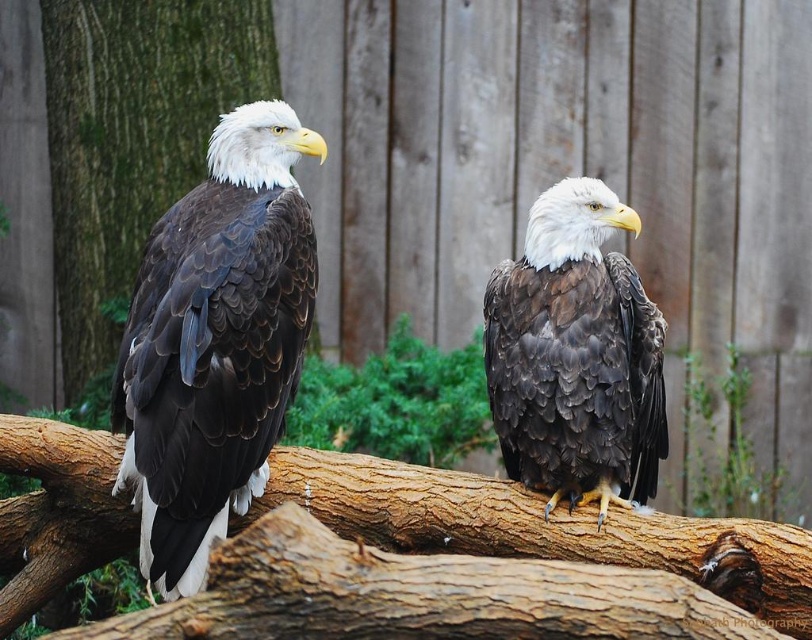
Between dark brown feathers at left and brown rough wood at center, which one appears on the left side from the viewer's perspective?

Positioned to the left is dark brown feathers at left.

Does dark brown feathers at left appear over brown rough wood at center?

Indeed, dark brown feathers at left is positioned over brown rough wood at center.

Is point (197, 541) farther from viewer compared to point (584, 522)?

No, it is not.

Where is `dark brown feathers at left`? This screenshot has height=640, width=812. dark brown feathers at left is located at coordinates click(x=214, y=340).

Is point (653, 516) less distant than point (504, 364)?

No, it is behind (504, 364).

Can you confirm if brown rough wood at center is wider than dark brown feathers at center?

Yes.

Between point (467, 490) and point (491, 346), which one is positioned behind?

The point (467, 490) is more distant.

What are the coordinates of `brown rough wood at center` in the screenshot? It's located at (541, 529).

Is point (45, 12) less distant than point (616, 310)?

No, (45, 12) is further to viewer.

Which is behind, point (184, 106) or point (545, 324)?

Positioned behind is point (184, 106).

I want to click on green bark tree at left, so click(132, 140).